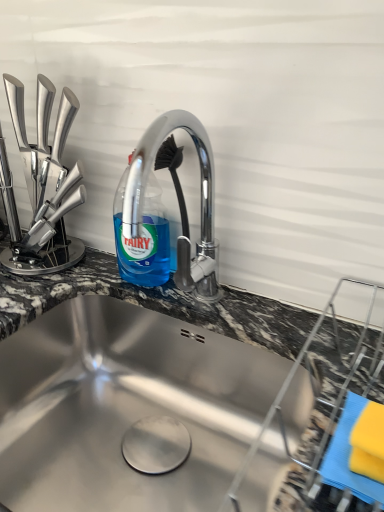
Question: Is point (152, 263) closer or farther from the camera than point (241, 358)?

Choices:
 (A) farther
 (B) closer

Answer: (A)

Question: From the image's perspective, is blue translucent liquid at upper center above or below stainless steel sink at center?

Choices:
 (A) above
 (B) below

Answer: (A)

Question: Is blue translucent liquid at upper center inside or outside of stainless steel sink at center?

Choices:
 (A) outside
 (B) inside

Answer: (A)

Question: Is point (190, 415) positioned closer to the camera than point (152, 210)?

Choices:
 (A) closer
 (B) farther

Answer: (A)

Question: From a real-world perspective, relative to blue translucent liquid at upper center, is stainless steel sink at center vertically above or below?

Choices:
 (A) above
 (B) below

Answer: (B)

Question: From the image's perspective, is stainless steel sink at center above or below blue translucent liquid at upper center?

Choices:
 (A) below
 (B) above

Answer: (A)

Question: In the image, is stainless steel sink at center on the left side or the right side of blue translucent liquid at upper center?

Choices:
 (A) left
 (B) right

Answer: (B)